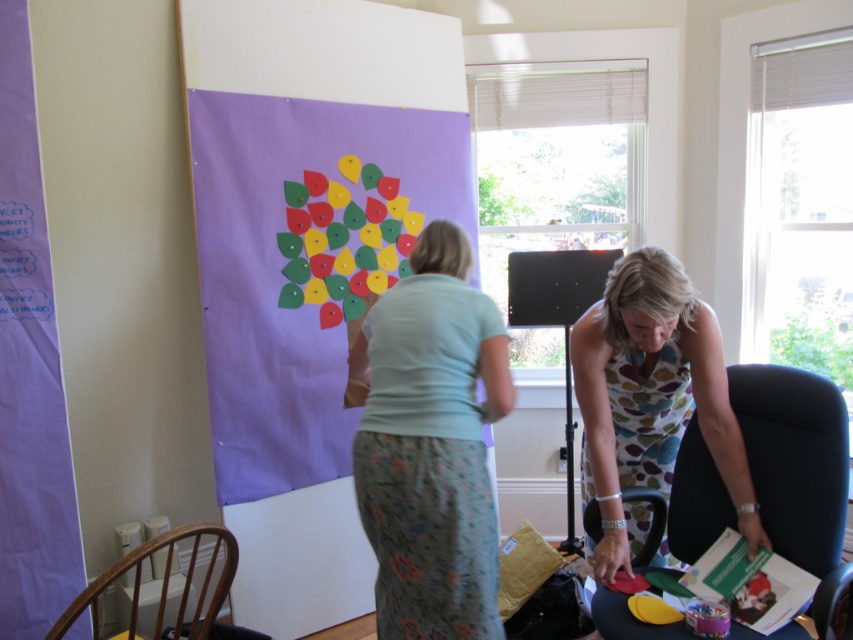
Question: Which object appears farthest from the camera in this image?

Choices:
 (A) floral dress at lower right
 (B) matte paper poster at center
 (C) matte plastic table at lower center
 (D) light blue fabric shirt at center

Answer: (B)

Question: Observing the image, what is the correct spatial positioning of matte paper poster at center in reference to matte plastic table at lower center?

Choices:
 (A) below
 (B) above

Answer: (B)

Question: Does floral dress at lower right appear on the left side of matte plastic table at lower center?

Choices:
 (A) no
 (B) yes

Answer: (B)

Question: Does light blue fabric shirt at center have a greater width compared to floral dress at lower right?

Choices:
 (A) yes
 (B) no

Answer: (B)

Question: Among these objects, which one is farthest from the camera?

Choices:
 (A) matte paper poster at center
 (B) floral dress at lower right
 (C) light blue fabric shirt at center
 (D) matte plastic table at lower center

Answer: (A)

Question: Which object is positioned closest to the light blue fabric shirt at center?

Choices:
 (A) matte plastic table at lower center
 (B) matte paper poster at center
 (C) floral dress at lower right

Answer: (C)